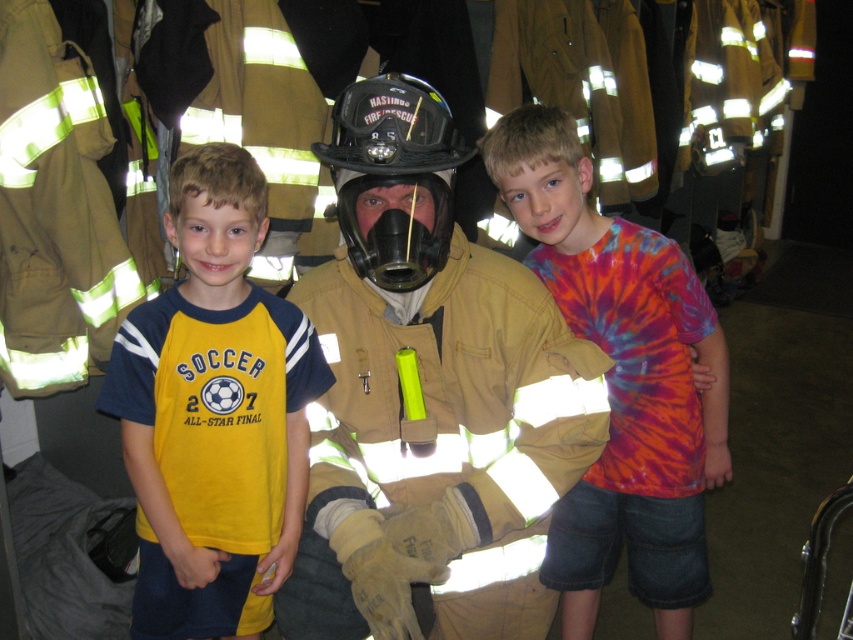
You are a visitor at the fire station and see the matte yellow fireman at center and the yellow fabric shirt at left. Which one is taller?

The matte yellow fireman at center is shorter than yellow fabric shirt at left.

You are standing in the fire station and want to hand a fire safety pamphlet to the closest person. Which one should you approach first, the matte yellow fireman at center or the yellow fabric shirt at left?

The matte yellow fireman at center is closer to the viewer than the yellow fabric shirt at left, so you should approach the matte yellow fireman at center first.